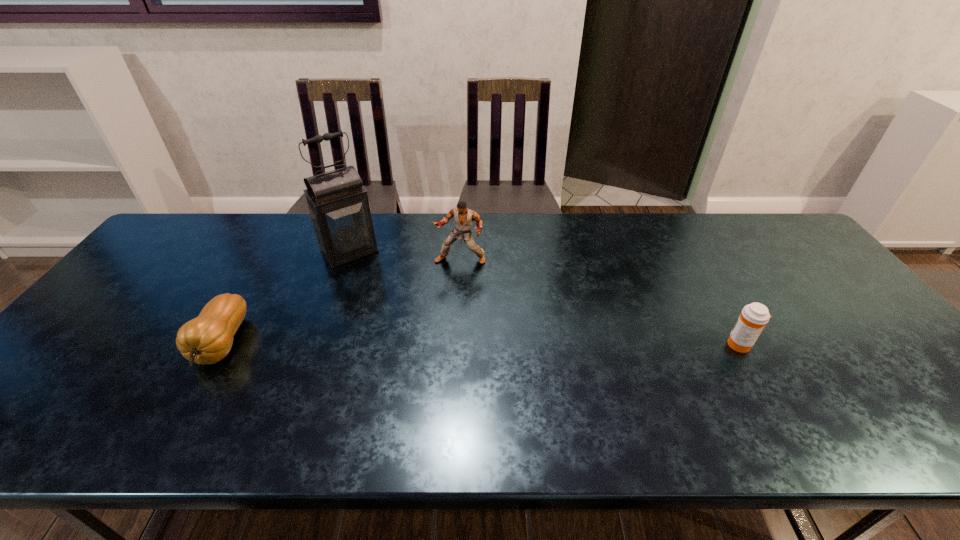
Where is `unoccupied area between the puncher and the rightmost object`? unoccupied area between the puncher and the rightmost object is located at coordinates (600, 302).

Locate which object is the closest to the third shortest object. Please provide its 2D coordinates. Your answer should be formatted as a tuple, i.e. [(x, y)], where the tuple contains the x and y coordinates of a point satisfying the conditions above.

[(338, 206)]

Locate which object ranks second in proximity to the lantern. Please provide its 2D coordinates. Your answer should be formatted as a tuple, i.e. [(x, y)], where the tuple contains the x and y coordinates of a point satisfying the conditions above.

[(208, 338)]

Image resolution: width=960 pixels, height=540 pixels. Identify the location of free point that satisfies the following two spatial constraints: 1. on the stem side of the gourd; 2. on the right side of the rightmost object. (222, 345).

The width and height of the screenshot is (960, 540). I want to click on free space that satisfies the following two spatial constraints: 1. on the stem side of the medicine; 2. on the left side of the leftmost object, so click(222, 345).

The width and height of the screenshot is (960, 540). Identify the location of free space that satisfies the following two spatial constraints: 1. on the stem side of the medicine; 2. on the left side of the gourd. (222, 345).